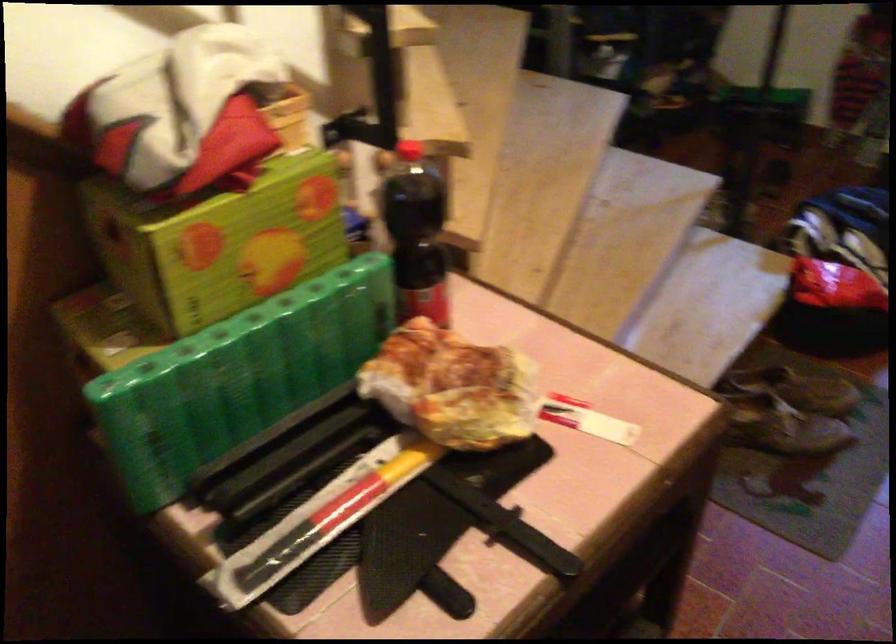
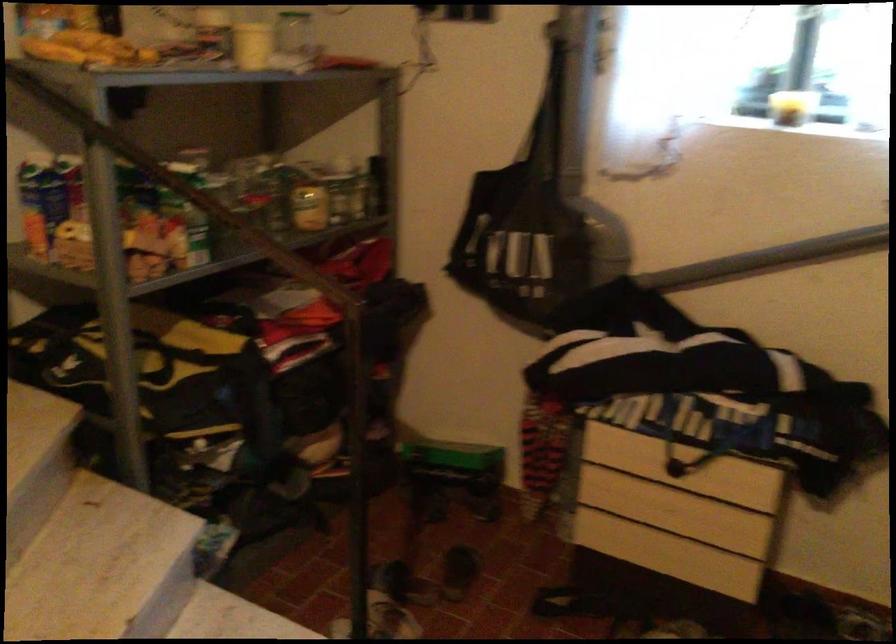
Where in the second image is the point corresponding to (x=659, y=104) from the first image?

(290, 495)